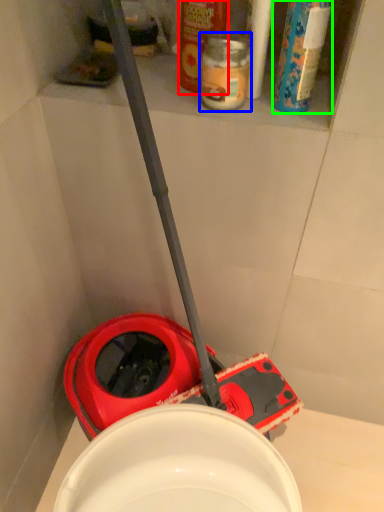
Question: Which object is positioned farthest from cleaning product (highlighted by a red box)? Select from bottle (highlighted by a blue box) and cleaning product (highlighted by a green box).

Choices:
 (A) bottle
 (B) cleaning product

Answer: (B)